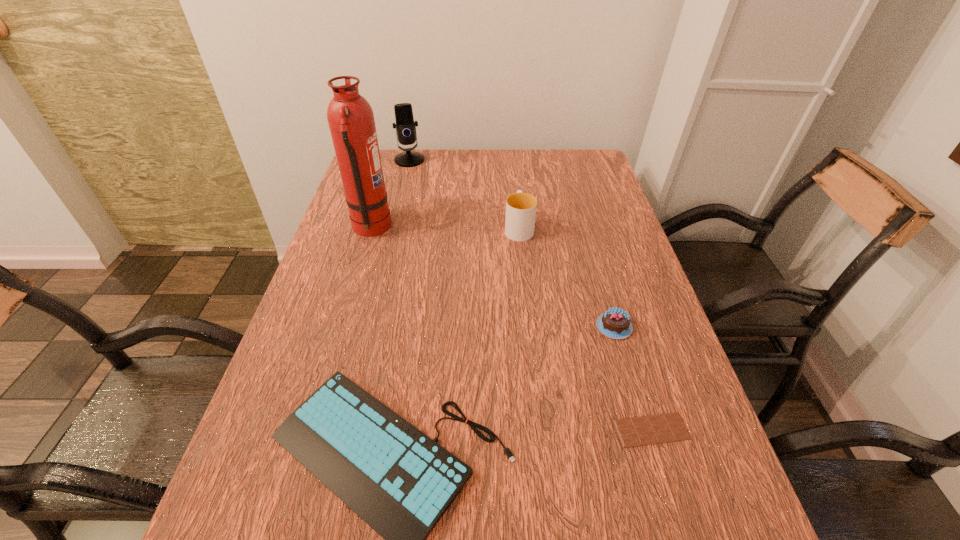
Locate which object ranks third in proximity to the fourth object from left to right. Please provide its 2D coordinates. Your answer should be formatted as a tuple, i.e. [(x, y)], where the tuple contains the x and y coordinates of a point satisfying the conditions above.

[(405, 125)]

The width and height of the screenshot is (960, 540). Identify the location of the fifth closest object to the computer keyboard. (x=405, y=125).

You are a GUI agent. You are given a task and a screenshot of the screen. Output one action in this format:
    pyautogui.click(x=<x>, y=<y>)
    Task: Click on the free spot that satisfies the following two spatial constraints: 1. on the label side of the tallest object; 2. on the left side of the shortest object
    The image size is (960, 540).
    Given the screenshot: What is the action you would take?
    pyautogui.click(x=311, y=430)

In order to click on free space in the image that satisfies the following two spatial constraints: 1. on the label side of the chocolate cake; 2. on the right side of the fire extinguisher in this screenshot , I will do `click(342, 327)`.

I want to click on vacant area in the image that satisfies the following two spatial constraints: 1. on the label side of the shortest object; 2. on the left side of the tallest object, so click(x=311, y=430).

Where is `vacant position in the image that satisfies the following two spatial constraints: 1. on the label side of the fire extinguisher; 2. on the back side of the shortest object`? vacant position in the image that satisfies the following two spatial constraints: 1. on the label side of the fire extinguisher; 2. on the back side of the shortest object is located at coordinates (311, 430).

Identify the location of vacant point that satisfies the following two spatial constraints: 1. on the label side of the tallest object; 2. on the back side of the fourth tallest object. (342, 327).

The width and height of the screenshot is (960, 540). In order to click on vacant space that satisfies the following two spatial constraints: 1. on the stand of the shortest object; 2. on the left side of the farthest object in this screenshot , I will do `click(345, 430)`.